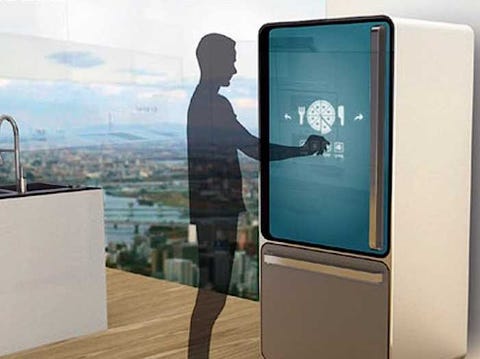
Find the where you'd open a refrigerator in the image. Your answer should be formatted as a list of tuples, i.e. [(x1, y1), (x2, y2), ...], where each tuple contains the x and y coordinates of a point satisfying the conditions above.

[(377, 152)]